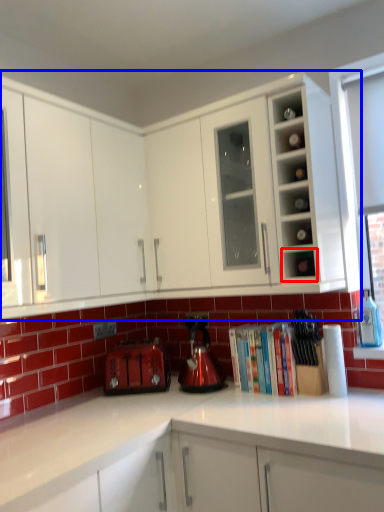
Question: Among these objects, which one is nearest to the camera, shelf (highlighted by a red box) or cabinetry (highlighted by a blue box)?

Choices:
 (A) shelf
 (B) cabinetry

Answer: (B)